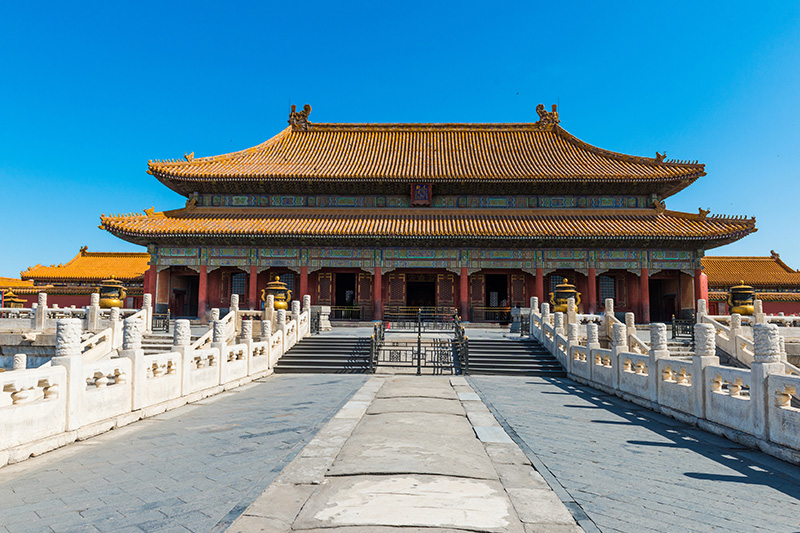
The height and width of the screenshot is (533, 800). I want to click on jars, so click(x=280, y=298), click(x=102, y=296), click(x=562, y=300), click(x=749, y=303).